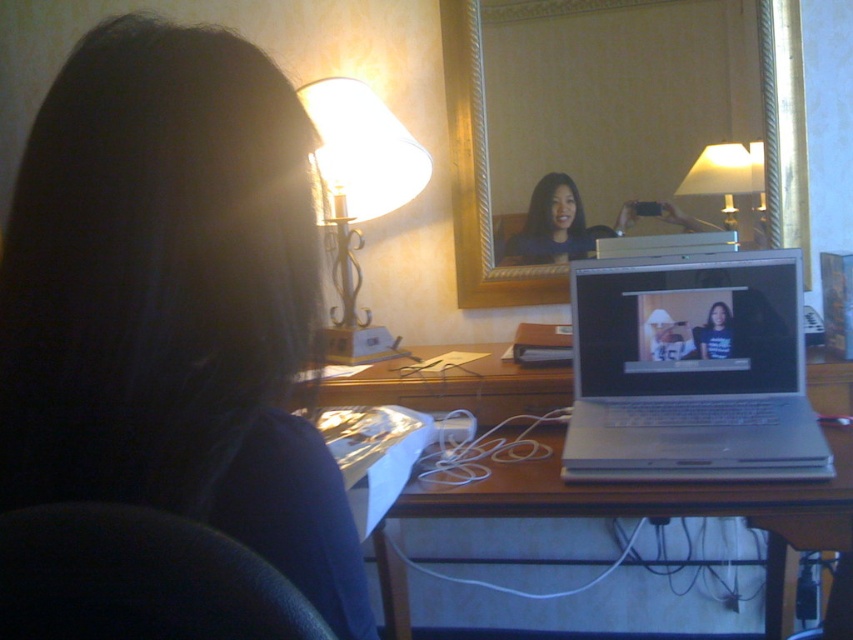
Can you confirm if white fabric lampshade at upper left is smaller than matte black laptop at center?

Incorrect, white fabric lampshade at upper left is not smaller in size than matte black laptop at center.

Is white fabric lampshade at upper left behind matte black laptop at center?

No, white fabric lampshade at upper left is closer to the viewer.

The image size is (853, 640). What do you see at coordinates (358, 193) in the screenshot? I see `white fabric lampshade at upper left` at bounding box center [358, 193].

Find the location of a particular element. The height and width of the screenshot is (640, 853). white fabric lampshade at upper left is located at coordinates (358, 193).

Does point (77, 134) come behind point (321, 216)?

No, (77, 134) is in front of (321, 216).

Between dark blue fabric at upper left and white fabric lampshade at upper left, which one is positioned higher?

white fabric lampshade at upper left is above.

Does point (177, 244) come closer to viewer compared to point (363, 88)?

Yes, point (177, 244) is closer to viewer.

Find the location of a particular element. dark blue fabric at upper left is located at coordinates (173, 304).

This screenshot has width=853, height=640. Find the location of `dark blue fabric at upper left`. dark blue fabric at upper left is located at coordinates (173, 304).

Is point (80, 198) positioned behind point (532, 212)?

No.

Where is `dark blue fabric at upper left`? dark blue fabric at upper left is located at coordinates (173, 304).